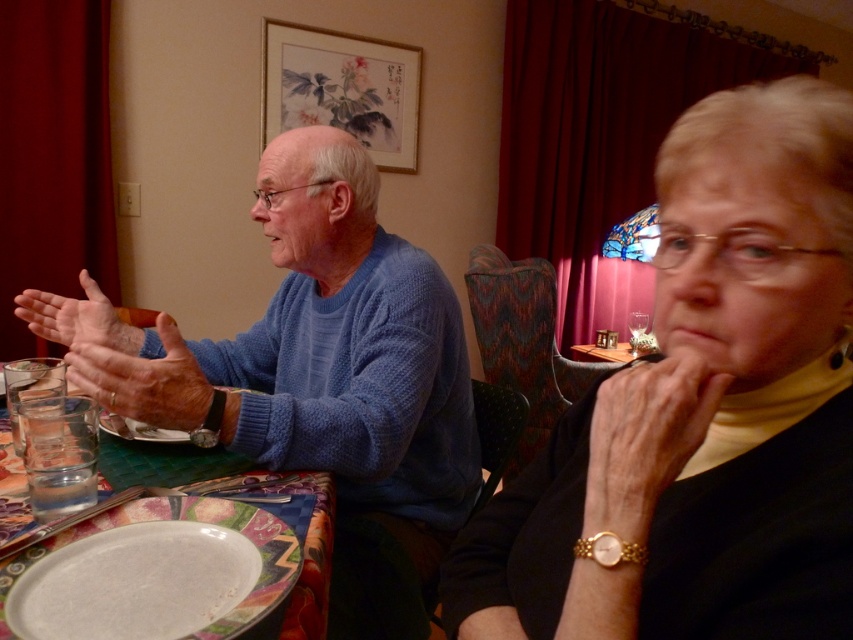
You are a photographer trying to capture the interaction between the man on the left and the woman on the right. You notice a smooth skin hand at lower right located at point (647, 432). Could this hand belong to either the man or the woman?

The smooth skin hand at lower right located at point (647, 432) belongs to the woman on the right because she is the one with her hand raised near her face.

You are a tailor who needs to determine which sweater requires more fabric for a custom order. Based on the image, which sweater between the matte black sweater at center and the blue knitted sweater at left has a larger width?

The blue knitted sweater at left has a greater width than the matte black sweater at center, so it would require more fabric for a custom order.